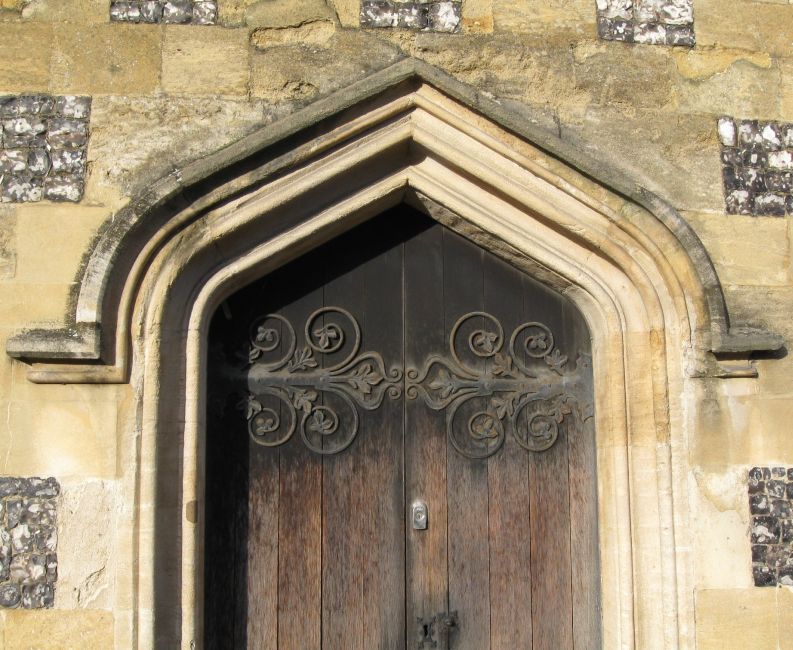
You are a GUI agent. You are given a task and a screenshot of the screen. Output one action in this format:
    pyautogui.click(x=<x>, y=<y>)
    Task: Click on the sloped right side top of door
    Image resolution: width=793 pixels, height=650 pixels.
    Given the screenshot: What is the action you would take?
    pyautogui.click(x=539, y=283)